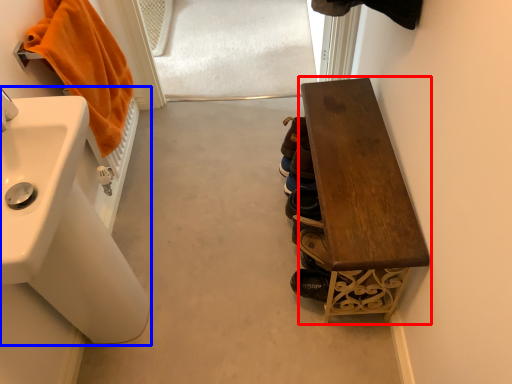
Question: Which object is further to the camera taking this photo, furniture (highlighted by a red box) or sink (highlighted by a blue box)?

Choices:
 (A) furniture
 (B) sink

Answer: (A)